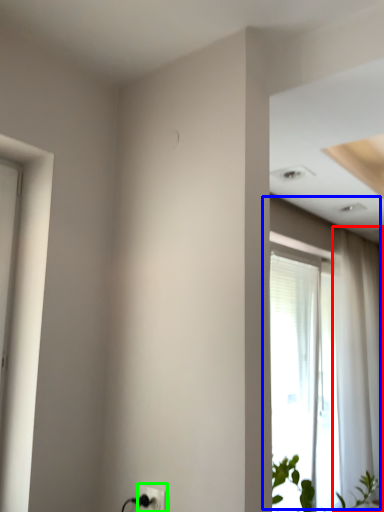
Question: Estimate the real-world distances between objects in this image. Which object is closer to curtain (highlighted by a red box), window (highlighted by a blue box) or electric outlet (highlighted by a green box)?

Choices:
 (A) window
 (B) electric outlet

Answer: (A)